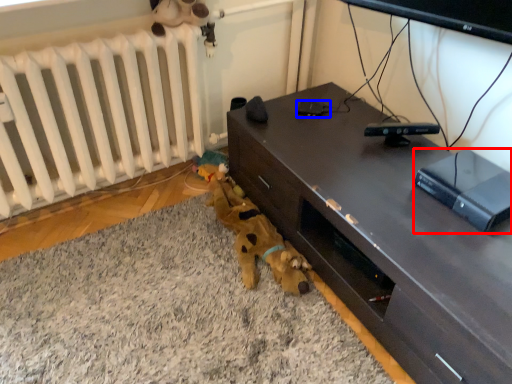
Question: Which object is further to the camera taking this photo, equipment (highlighted by a red box) or gadget (highlighted by a blue box)?

Choices:
 (A) equipment
 (B) gadget

Answer: (B)